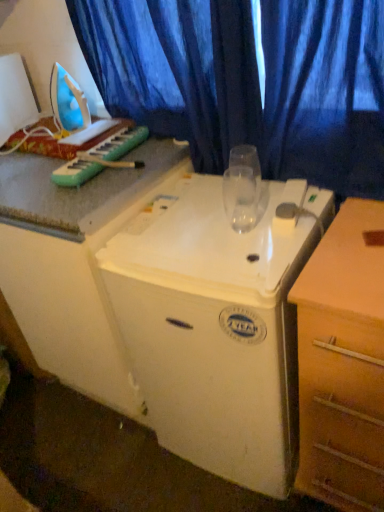
This screenshot has width=384, height=512. Find the location of `free space behind transparent glass at center`. free space behind transparent glass at center is located at coordinates (228, 198).